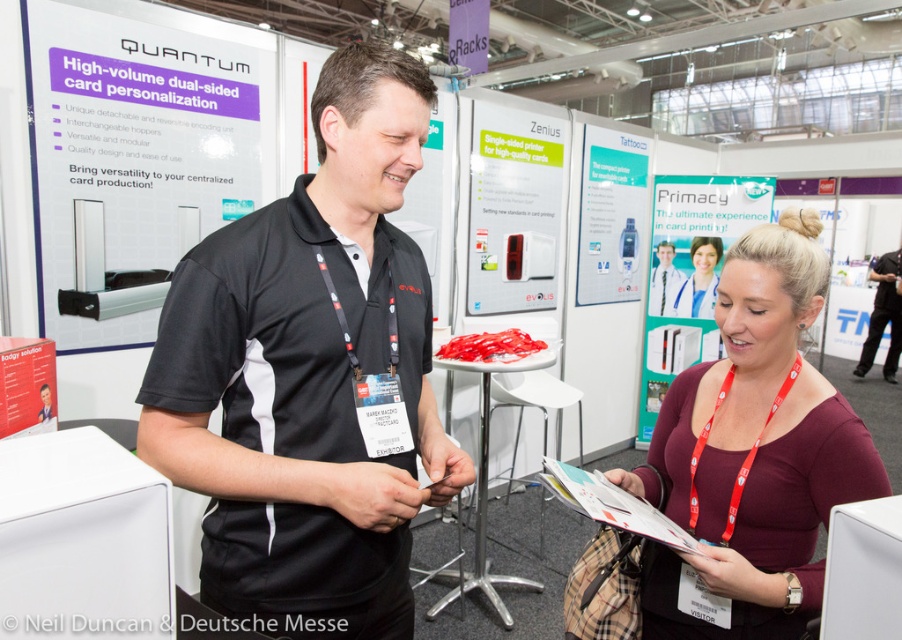
Question: Does black matte shirt at center have a lesser width compared to black fabric shirt at upper right?

Choices:
 (A) yes
 (B) no

Answer: (B)

Question: Which of these objects is positioned farthest from the black matte shirt at center?

Choices:
 (A) red paper poster at lower left
 (B) white plastic printer at center
 (C) white plastic printer at upper center

Answer: (C)

Question: Is white glossy printer at upper center behind black fabric shirt at upper right?

Choices:
 (A) no
 (B) yes

Answer: (A)

Question: Which of the following is the closest to the observer?

Choices:
 (A) matte white id card at center
 (B) white plastic printer at upper center
 (C) maroon jersey at center
 (D) silver metallic card personalization machine at upper left

Answer: (C)

Question: Does black matte shirt at center have a larger size compared to white plastic printer at upper center?

Choices:
 (A) no
 (B) yes

Answer: (A)

Question: Among these objects, which one is farthest from the camera?

Choices:
 (A) white plastic printer at center
 (B) silver metallic card personalization machine at upper left
 (C) black matte shirt at center

Answer: (A)